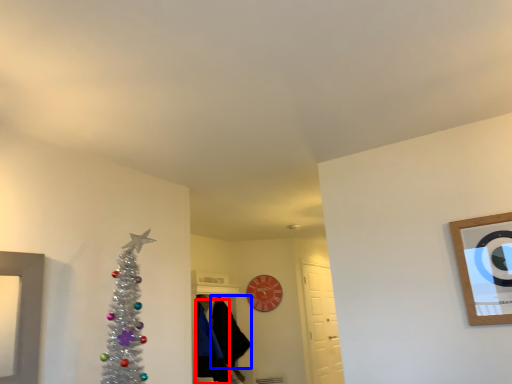
Question: Which object is further to the camera taking this photo, robe (highlighted by a red box) or robe (highlighted by a blue box)?

Choices:
 (A) robe
 (B) robe

Answer: (B)